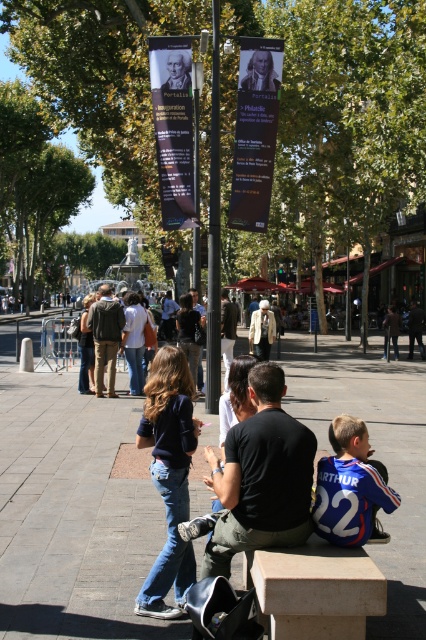
Is beige stone bench at center to the left of dark brown leather jacket at center from the viewer's perspective?

In fact, beige stone bench at center is to the right of dark brown leather jacket at center.

Between point (296, 620) and point (106, 292), which one is positioned behind?

Positioned behind is point (106, 292).

Which is in front, point (270, 560) or point (103, 296)?

Point (270, 560) is in front.

Where is `beige stone bench at center`? beige stone bench at center is located at coordinates (316, 589).

Measure the distance between black matte shirt at center and beige stone bench at center.

42.41 centimeters

This screenshot has height=640, width=426. What do you see at coordinates (261, 477) in the screenshot? I see `black matte shirt at center` at bounding box center [261, 477].

Locate an element on the screen. black matte shirt at center is located at coordinates (261, 477).

Between beige stone bench at center and light brown leather jacket at center, which one appears on the left side from the viewer's perspective?

Positioned to the left is light brown leather jacket at center.

Can you confirm if beige stone bench at center is bigger than light brown leather jacket at center?

Actually, beige stone bench at center might be smaller than light brown leather jacket at center.

Between point (313, 576) and point (232, 346), which one is positioned behind?

Positioned behind is point (232, 346).

You are a GUI agent. You are given a task and a screenshot of the screen. Output one action in this format:
    pyautogui.click(x=<x>, y=<y>)
    Task: Click on the beige stone bench at center
    The height and width of the screenshot is (640, 426).
    Given the screenshot: What is the action you would take?
    pyautogui.click(x=316, y=589)